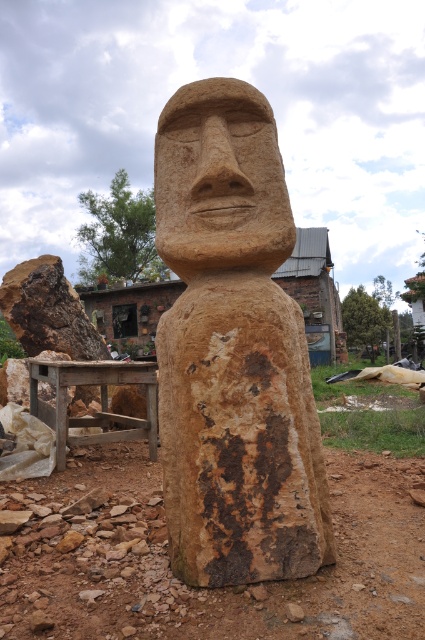
Question: Which point is farther to the camera?

Choices:
 (A) (269, 440)
 (B) (263, 225)

Answer: (B)

Question: Is brown stone statue at center wider than brown stone face at center?

Choices:
 (A) yes
 (B) no

Answer: (A)

Question: Is the position of brown stone statue at center more distant than that of brown stone face at center?

Choices:
 (A) no
 (B) yes

Answer: (A)

Question: Is brown stone statue at center below brown stone face at center?

Choices:
 (A) no
 (B) yes

Answer: (B)

Question: Which of the following is the farthest from the observer?

Choices:
 (A) brown stone statue at center
 (B) brown stone face at center

Answer: (B)

Question: Which of the following is the farthest from the observer?

Choices:
 (A) brown stone face at center
 (B) brown stone statue at center

Answer: (A)